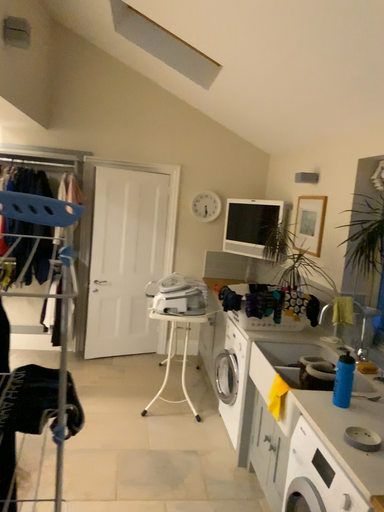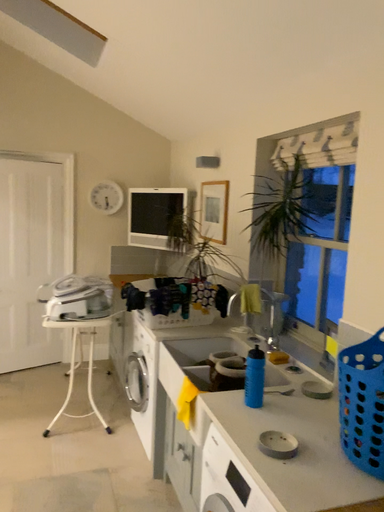
Question: Which way did the camera rotate in the video?

Choices:
 (A) rotated left
 (B) rotated right

Answer: (B)